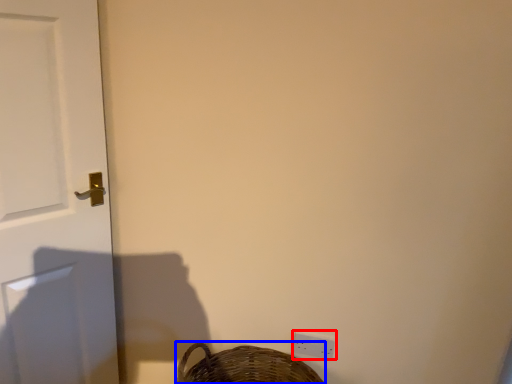
Question: Which object appears farthest to the camera in this image, light switch (highlighted by a red box) or basket (highlighted by a blue box)?

Choices:
 (A) light switch
 (B) basket

Answer: (A)